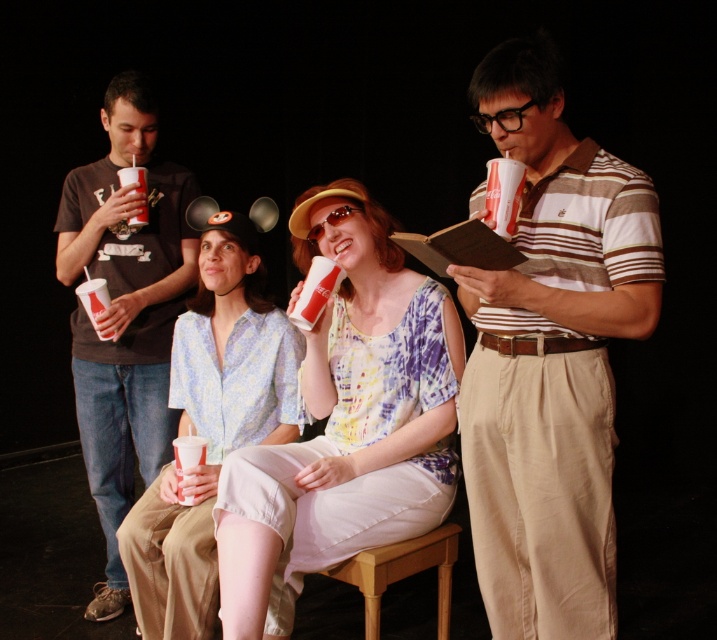
The image size is (717, 640). Describe the element at coordinates (550, 356) in the screenshot. I see `brown striped shirt at center` at that location.

Is point (619, 314) positioned before point (133, 170)?

Yes, it is in front of point (133, 170).

At what (x,y) coordinates should I click in order to perform the action: click on brown striped shirt at center. Please return your answer as a coordinate pair (x, y). Looking at the image, I should click on (550, 356).

Does matte tie-dye blouse at center have a lesser width compared to translucent plastic cup at upper left?

No, matte tie-dye blouse at center is not thinner than translucent plastic cup at upper left.

Which is behind, point (394, 324) or point (141, 192)?

Positioned behind is point (141, 192).

Where is `matte tie-dye blouse at center`? matte tie-dye blouse at center is located at coordinates (346, 422).

Identify the location of matte tie-dye blouse at center. (346, 422).

Is matte tie-dye blouse at center positioned behind translucent plastic cup at left?

No, matte tie-dye blouse at center is in front of translucent plastic cup at left.

Can you confirm if matte tie-dye blouse at center is wider than translucent plastic cup at left?

Correct, the width of matte tie-dye blouse at center exceeds that of translucent plastic cup at left.

The width and height of the screenshot is (717, 640). Identify the location of matte tie-dye blouse at center. point(346,422).

Locate an element on the screen. The image size is (717, 640). matte tie-dye blouse at center is located at coordinates (346, 422).